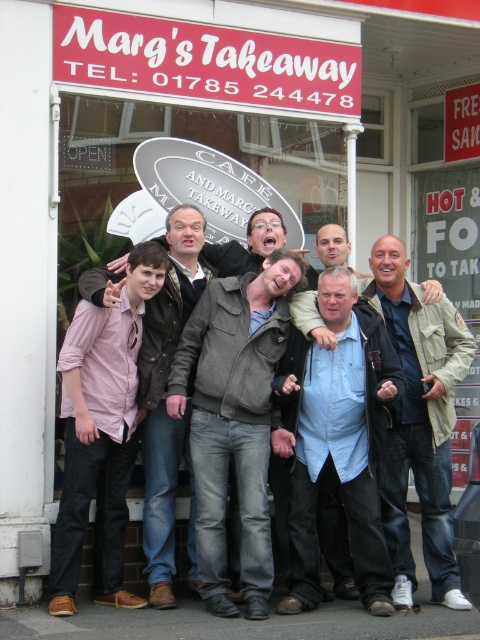
Question: Which is farther from the khaki cotton jacket at center?

Choices:
 (A) blue denim shirt at center
 (B) pink fabric shirt at left
 (C) pink shirt at center

Answer: (B)

Question: Does dark grey textured jacket at center come in front of khaki cotton jacket at center?

Choices:
 (A) no
 (B) yes

Answer: (B)

Question: Which point is farther to the camera?

Choices:
 (A) (100, 525)
 (B) (213, 554)

Answer: (A)

Question: Does dark grey textured jacket at center appear over pink fabric shirt at left?

Choices:
 (A) no
 (B) yes

Answer: (B)

Question: Is blue denim shirt at center to the left of pink fabric shirt at left from the viewer's perspective?

Choices:
 (A) no
 (B) yes

Answer: (A)

Question: Which point appears closest to the camera in this image?

Choices:
 (A) (255, 456)
 (B) (452, 310)
 (C) (171, 310)

Answer: (A)